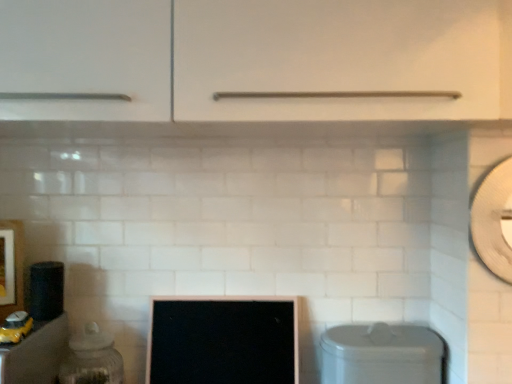
Image resolution: width=512 pixels, height=384 pixels. I want to click on white matte cabinet handle at center, the 2th cabinetry positioned from the bottom, so click(342, 58).

This screenshot has height=384, width=512. What are the coordinates of `matte black cabinet at lower left, which ranks as the second cabinetry in front-to-back order` in the screenshot? It's located at (36, 354).

Locate an element on the screen. black glossy computer monitor at center is located at coordinates (223, 340).

Locate an element on the screen. The image size is (512, 384). wooden framed picture at left is located at coordinates (11, 267).

Where is `satin silver dishwasher at lower center`? satin silver dishwasher at lower center is located at coordinates (381, 354).

Where is `white matte cabinet handle at center, which appears as the 2th cabinetry when viewed from the left`? white matte cabinet handle at center, which appears as the 2th cabinetry when viewed from the left is located at coordinates (342, 58).

Is matte black cabinet at lower left, placed as the second cabinetry when sorted from right to left, next to black glossy computer monitor at center?

No, matte black cabinet at lower left, placed as the second cabinetry when sorted from right to left, is not in contact with black glossy computer monitor at center.

You are a GUI agent. You are given a task and a screenshot of the screen. Output one action in this format:
    pyautogui.click(x=<x>, y=<y>)
    Task: Click on the cabinetry below the black glossy computer monitor at center (from a real-world perspective)
    This screenshot has width=512, height=384.
    Given the screenshot: What is the action you would take?
    pyautogui.click(x=36, y=354)

Is matte black cabinet at lower left, which is counted as the 1th cabinetry, starting from the back, thinner than black glossy computer monitor at center?

In fact, matte black cabinet at lower left, which is counted as the 1th cabinetry, starting from the back, might be wider than black glossy computer monitor at center.

Which object is positioned more to the right, matte black cabinet at lower left, placed as the second cabinetry when sorted from top to bottom, or black glossy computer monitor at center?

black glossy computer monitor at center.

Is black glossy computer monitor at center facing towards satin silver dishwasher at lower center?

No, black glossy computer monitor at center is not turned towards satin silver dishwasher at lower center.

Which is more to the right, black glossy computer monitor at center or satin silver dishwasher at lower center?

satin silver dishwasher at lower center.

From a real-world perspective, relative to satin silver dishwasher at lower center, is black glossy computer monitor at center vertically above or below?

From a real-world perspective, black glossy computer monitor at center is physically above satin silver dishwasher at lower center.

Would you say white matte cabinet handle at center, the 2th cabinetry positioned from the bottom, contains black glossy computer monitor at center?

No, black glossy computer monitor at center is not a part of white matte cabinet handle at center, the 2th cabinetry positioned from the bottom.

Looking at this image, how distant is white matte cabinet handle at center, the 2th cabinetry from the back, from black glossy computer monitor at center?

white matte cabinet handle at center, the 2th cabinetry from the back, and black glossy computer monitor at center are 27.87 inches apart.

Is white matte cabinet handle at center, the first cabinetry from the right, bigger than black glossy computer monitor at center?

Yes.

Considering the positions of point (457, 76) and point (192, 381), is point (457, 76) closer or farther from the camera than point (192, 381)?

Point (457, 76).

Would you say satin silver dishwasher at lower center contains black glossy computer monitor at center?

Actually, black glossy computer monitor at center is outside satin silver dishwasher at lower center.

In the scene shown: From a real-world perspective, who is located higher, satin silver dishwasher at lower center or black glossy computer monitor at center?

From a 3D spatial view, black glossy computer monitor at center is above.

Which of these two, satin silver dishwasher at lower center or black glossy computer monitor at center, is bigger?

With larger size is black glossy computer monitor at center.

What's the angular difference between satin silver dishwasher at lower center and black glossy computer monitor at center's facing directions?

The angle between the facing direction of satin silver dishwasher at lower center and the facing direction of black glossy computer monitor at center is 1.71 degrees.

What's the angular difference between matte black cabinet at lower left, placed as the second cabinetry when sorted from right to left, and white matte cabinet handle at center, the 2th cabinetry positioned from the bottom,'s facing directions?

matte black cabinet at lower left, placed as the second cabinetry when sorted from right to left, and white matte cabinet handle at center, the 2th cabinetry positioned from the bottom, are facing 0.0821 degrees away from each other.

Considering the sizes of matte black cabinet at lower left, which ranks as the second cabinetry in front-to-back order, and white matte cabinet handle at center, placed as the first cabinetry when sorted from front to back, in the image, is matte black cabinet at lower left, which ranks as the second cabinetry in front-to-back order, wider or thinner than white matte cabinet handle at center, placed as the first cabinetry when sorted from front to back,?

Clearly, matte black cabinet at lower left, which ranks as the second cabinetry in front-to-back order, has more width compared to white matte cabinet handle at center, placed as the first cabinetry when sorted from front to back.

From a real-world perspective, which object rests below the other?

matte black cabinet at lower left, which is counted as the 1th cabinetry, starting from the back, from a real-world perspective.

Could you tell me if matte black cabinet at lower left, placed as the second cabinetry when sorted from top to bottom, is turned towards white matte cabinet handle at center, placed as the 1th cabinetry when sorted from top to bottom?

No, matte black cabinet at lower left, placed as the second cabinetry when sorted from top to bottom, is not turned towards white matte cabinet handle at center, placed as the 1th cabinetry when sorted from top to bottom.

Considering the relative positions of wooden framed picture at left and clear glass jar at left, acting as the first appliance starting from the right, in the image provided, is wooden framed picture at left to the left of clear glass jar at left, acting as the first appliance starting from the right, from the viewer's perspective?

Indeed, wooden framed picture at left is positioned on the left side of clear glass jar at left, acting as the first appliance starting from the right.

Considering the relative sizes of wooden framed picture at left and clear glass jar at left, which is counted as the 2th appliance, starting from the left, in the image provided, is wooden framed picture at left smaller than clear glass jar at left, which is counted as the 2th appliance, starting from the left,?

Yes, wooden framed picture at left is smaller than clear glass jar at left, which is counted as the 2th appliance, starting from the left.

Are wooden framed picture at left and clear glass jar at left, acting as the first appliance starting from the right, far apart?

Actually, wooden framed picture at left and clear glass jar at left, acting as the first appliance starting from the right, are a little close together.

Which of these two, wooden framed picture at left or clear glass jar at left, acting as the first appliance starting from the right, is thinner?

wooden framed picture at left is thinner.

Is wooden framed picture at left in contact with white matte cabinet handle at center, placed as the 1th cabinetry when sorted from top to bottom?

They are not placed beside each other.

Which is correct: wooden framed picture at left is inside white matte cabinet handle at center, placed as the first cabinetry when sorted from front to back, or outside of it?

wooden framed picture at left cannot be found inside white matte cabinet handle at center, placed as the first cabinetry when sorted from front to back.

Considering the positions of point (1, 250) and point (329, 42), is point (1, 250) closer or farther from the camera than point (329, 42)?

Point (1, 250).

From a real-world perspective, is wooden framed picture at left on top of white matte cabinet handle at center, the 2th cabinetry from the back?

Actually, wooden framed picture at left is physically below white matte cabinet handle at center, the 2th cabinetry from the back, in the real world.

The height and width of the screenshot is (384, 512). I want to click on the 1st cabinetry in front of the black glossy computer monitor at center, starting your count from the anchor, so click(x=36, y=354).

Locate an element on the screen. The width and height of the screenshot is (512, 384). computer monitor on the left of the satin silver dishwasher at lower center is located at coordinates (223, 340).

Considering their positions, is clear glass jar at left, which is the first appliance from bottom to top, positioned further to wooden framed picture at left than satin silver dishwasher at lower center?

satin silver dishwasher at lower center is further to wooden framed picture at left.

When comparing their distances from white matte cabinet handle at center, placed as the 1th cabinetry when sorted from top to bottom, does black glossy computer monitor at center or matte black cabinet at lower left, placed as the second cabinetry when sorted from top to bottom, seem further?

Based on the image, matte black cabinet at lower left, placed as the second cabinetry when sorted from top to bottom, appears to be further to white matte cabinet handle at center, placed as the 1th cabinetry when sorted from top to bottom.

Based on the photo, estimate the real-world distances between objects in this image. Which object is further from matte black speaker at left, the second appliance in the bottom-to-top sequence, satin silver dishwasher at lower center or wooden framed picture at left?

satin silver dishwasher at lower center lies further to matte black speaker at left, the second appliance in the bottom-to-top sequence, than the other object.

Which object lies further to the anchor point matte black speaker at left, placed as the 1th appliance when sorted from left to right, matte black cabinet at lower left, which is counted as the 1th cabinetry, starting from the back, or satin silver dishwasher at lower center?

Based on the image, satin silver dishwasher at lower center appears to be further to matte black speaker at left, placed as the 1th appliance when sorted from left to right.

Looking at the image, which one is located closer to wooden framed picture at left, clear glass jar at left, which is the first appliance from bottom to top, or black glossy computer monitor at center?

Based on the image, clear glass jar at left, which is the first appliance from bottom to top, appears to be nearer to wooden framed picture at left.

Looking at the image, which one is located closer to satin silver dishwasher at lower center, black glossy computer monitor at center or white matte cabinet handle at center, placed as the 1th cabinetry when sorted from top to bottom?

Among the two, black glossy computer monitor at center is located nearer to satin silver dishwasher at lower center.

Based on their spatial positions, is matte black speaker at left, the 1th appliance from the top, or wooden framed picture at left closer to satin silver dishwasher at lower center?

Among the two, matte black speaker at left, the 1th appliance from the top, is located nearer to satin silver dishwasher at lower center.

Looking at the image, which one is located closer to satin silver dishwasher at lower center, wooden framed picture at left or clear glass jar at left, arranged as the 2th appliance when viewed from the top?

clear glass jar at left, arranged as the 2th appliance when viewed from the top.

At what (x,y) coordinates should I click in order to perform the action: click on appliance between wooden framed picture at left and clear glass jar at left, which is the first appliance from bottom to top, in the horizontal direction. Please return your answer as a coordinate pair (x, y). This screenshot has width=512, height=384. Looking at the image, I should click on [x=46, y=290].

Find the location of a particular element. The image size is (512, 384). cabinetry between white matte cabinet handle at center, the 2th cabinetry positioned from the bottom, and clear glass jar at left, arranged as the 2th appliance when viewed from the top, in the vertical direction is located at coordinates (36, 354).

What are the coordinates of `cabinetry that lies between wooden framed picture at left and clear glass jar at left, arranged as the 2th appliance when viewed from the top, from top to bottom` in the screenshot? It's located at (36, 354).

Image resolution: width=512 pixels, height=384 pixels. I want to click on computer monitor situated between matte black cabinet at lower left, placed as the second cabinetry when sorted from top to bottom, and satin silver dishwasher at lower center from left to right, so click(x=223, y=340).